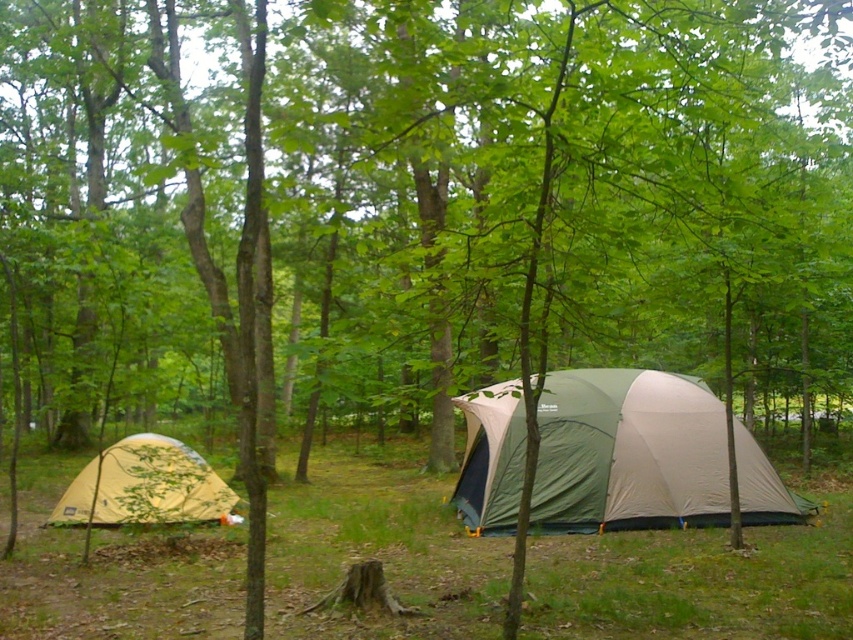
You are planning to set up a new tent in the camping area shown. You have a tall camping gear that needs to fit inside the tent. Which tent between the green fabric tent at center and the yellow fabric tent at lower left should you choose?

The green fabric tent at center is taller than the yellow fabric tent at lower left, so you should choose the green fabric tent at center to accommodate your tall camping gear.

You are a hiker who wants to set up a new tent between the green fabric tent at center and the yellow fabric tent at lower left. Based on their positions, which tent should you place your new tent closer to in order to maintain the existing spacing between the two original tents?

The green fabric tent at center is positioned on the right side of yellow fabric tent at lower left. To maintain the existing spacing, you should place your new tent closer to the yellow fabric tent at lower left so that it aligns with the current arrangement.

You are a hiker who just arrived at the campsite and want to set up your tent. You see the green fabric tent at center and the yellow fabric tent at lower left. Which tent is closer to you?

The green fabric tent at center is closer to you because it is further to the viewer than the yellow fabric tent at lower left, meaning it is positioned nearer in the scene.